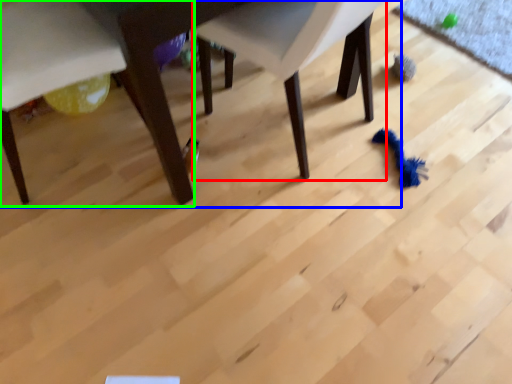
Question: Which object is the farthest from chair (highlighted by a red box)? Choose among these: table (highlighted by a blue box) or chair (highlighted by a green box).

Choices:
 (A) table
 (B) chair

Answer: (B)